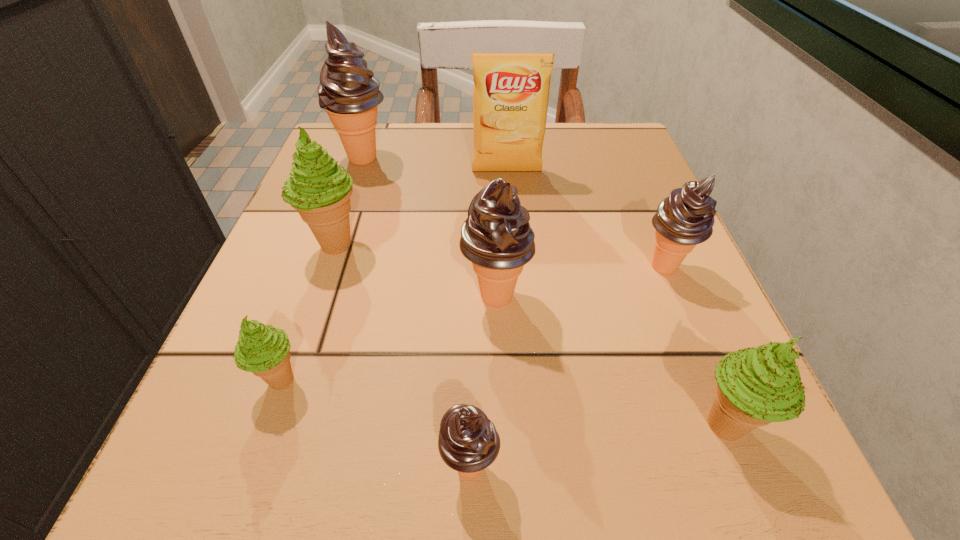
I want to click on free space located on the front of the crisp (potato chip) with the logo, so click(516, 298).

The width and height of the screenshot is (960, 540). Find the location of `vacant point located 0.310m on the right of the farthest green icecream`. vacant point located 0.310m on the right of the farthest green icecream is located at coordinates (556, 244).

Where is `vacant space located 0.130m on the left of the second biggest chocolate icecream`? vacant space located 0.130m on the left of the second biggest chocolate icecream is located at coordinates (372, 296).

Identify the location of vacant position located 0.080m on the back of the third biggest chocolate icecream. click(645, 220).

The image size is (960, 540). Identify the location of vacant space located 0.290m on the back of the second smallest green icecream. (648, 237).

You are a GUI agent. You are given a task and a screenshot of the screen. Output one action in this format:
    pyautogui.click(x=<x>, y=<y>)
    Task: Click on the vacant position located 0.380m on the back of the smallest green icecream
    The width and height of the screenshot is (960, 540).
    Given the screenshot: What is the action you would take?
    pyautogui.click(x=349, y=189)

Identify the location of vacant space positioned on the back of the smallest chocolate icecream. Image resolution: width=960 pixels, height=540 pixels. (473, 279).

In order to click on icecream that is at the far edge in this screenshot , I will do `click(348, 92)`.

Find the location of a particular element. Image resolution: width=960 pixels, height=540 pixels. crisp (potato chip) situated at the far edge is located at coordinates (511, 90).

In order to click on object present at the far left corner in this screenshot , I will do `click(348, 92)`.